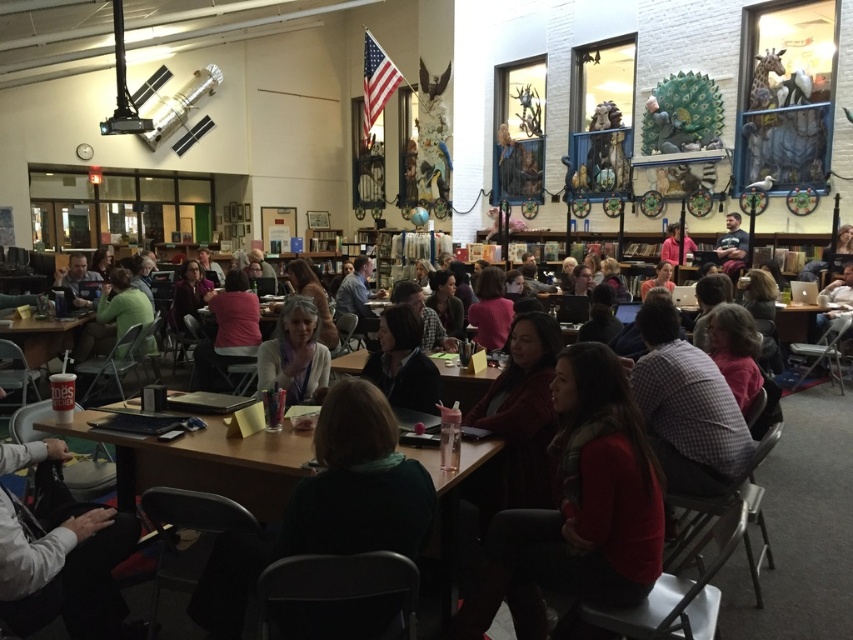
Is point (122, 454) closer to viewer compared to point (421, 349)?

That is True.

Does wooden table at center appear on the right side of matte black jacket at center?

In fact, wooden table at center is to the left of matte black jacket at center.

This screenshot has width=853, height=640. I want to click on wooden table at center, so click(x=207, y=461).

Measure the distance between red wool scarf at center and camera.

red wool scarf at center and camera are 6.56 feet apart.

Where is `red wool scarf at center`? The image size is (853, 640). red wool scarf at center is located at coordinates (583, 502).

Locate an element on the screen. This screenshot has height=640, width=853. red wool scarf at center is located at coordinates (583, 502).

You are a GUI agent. You are given a task and a screenshot of the screen. Output one action in this format:
    pyautogui.click(x=<x>, y=<y>)
    Task: Click on the red wool scarf at center
    This screenshot has width=853, height=640.
    Given the screenshot: What is the action you would take?
    pyautogui.click(x=583, y=502)

Who is more distant from viewer, (x=569, y=554) or (x=430, y=365)?

The point (x=430, y=365) is behind.

Measure the distance between red wool scarf at center and matte black jacket at center.

red wool scarf at center is 3.42 feet from matte black jacket at center.

Locate an element on the screen. red wool scarf at center is located at coordinates (583, 502).

Where is `red wool scarf at center`? Image resolution: width=853 pixels, height=640 pixels. red wool scarf at center is located at coordinates (583, 502).